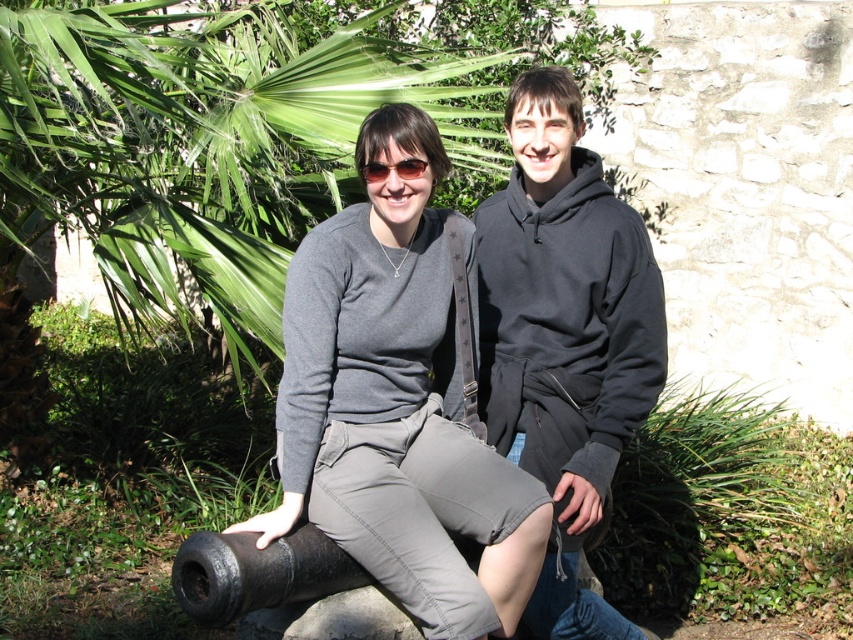
Question: Which object appears closest to the camera in this image?

Choices:
 (A) black fleece sweatshirt at center
 (B) matte gray sweatshirt at center

Answer: (B)

Question: Does matte gray pants at center have a greater width compared to matte black sunglasses at center?

Choices:
 (A) no
 (B) yes

Answer: (B)

Question: Which point is closer to the camera taking this photo?

Choices:
 (A) (248, 120)
 (B) (515, 337)

Answer: (B)

Question: Among these objects, which one is nearest to the camera?

Choices:
 (A) green leafy palm tree at upper left
 (B) black fleece sweatshirt at center
 (C) matte gray sweatshirt at center
 (D) matte gray pants at center

Answer: (D)

Question: From the image, what is the correct spatial relationship of black matte cannon at lower left in relation to matte black sunglasses at center?

Choices:
 (A) left
 (B) right

Answer: (A)

Question: Can you confirm if black fleece sweatshirt at center is positioned to the left of matte black sunglasses at center?

Choices:
 (A) yes
 (B) no

Answer: (B)